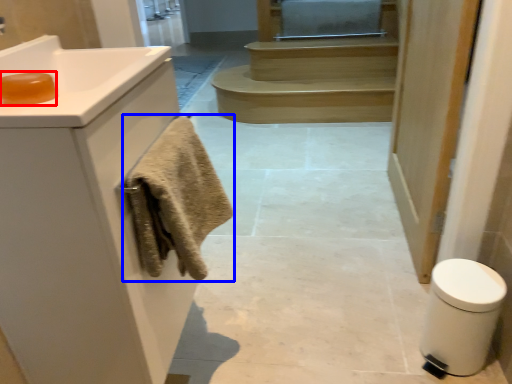
Question: Which object appears closest to the camera in this image, soap (highlighted by a red box) or bath towel (highlighted by a blue box)?

Choices:
 (A) soap
 (B) bath towel

Answer: (A)